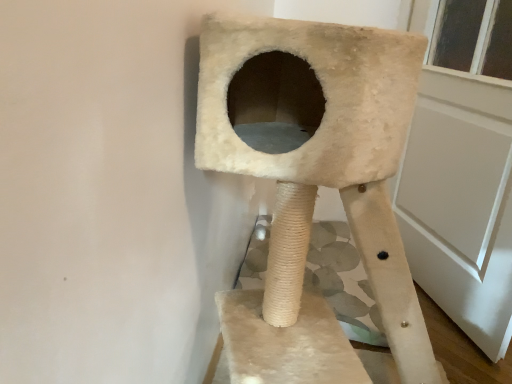
What do you see at coordinates (460, 193) in the screenshot?
I see `white matte screen door at right` at bounding box center [460, 193].

Locate an element on the screen. white matte screen door at right is located at coordinates (460, 193).

What do you see at coordinates (312, 183) in the screenshot? I see `beige furry cat tree at center` at bounding box center [312, 183].

Where is `beige furry cat tree at center`? beige furry cat tree at center is located at coordinates (312, 183).

Image resolution: width=512 pixels, height=384 pixels. I want to click on white matte screen door at right, so click(460, 193).

Does beige furry cat tree at center appear on the left side of white matte screen door at right?

Indeed, beige furry cat tree at center is positioned on the left side of white matte screen door at right.

Between beige furry cat tree at center and white matte screen door at right, which one is positioned in front?

Positioned in front is beige furry cat tree at center.

Looking at this image, which is farther from the camera, (231, 315) or (508, 166)?

The point (508, 166) is farther from the camera.

From the image's perspective, which one is positioned higher, beige furry cat tree at center or white matte screen door at right?

white matte screen door at right.

From the picture: From a real-world perspective, is beige furry cat tree at center under white matte screen door at right?

Yes.

Considering the relative sizes of beige furry cat tree at center and white matte screen door at right in the image provided, is beige furry cat tree at center wider than white matte screen door at right?

Correct, the width of beige furry cat tree at center exceeds that of white matte screen door at right.

Is beige furry cat tree at center taller than white matte screen door at right?

No.

Between beige furry cat tree at center and white matte screen door at right, which one has larger size?

Bigger between the two is beige furry cat tree at center.

Is white matte screen door at right surrounded by beige furry cat tree at center?

That's incorrect, white matte screen door at right is not inside beige furry cat tree at center.

Is beige furry cat tree at center beside white matte screen door at right?

There is a gap between beige furry cat tree at center and white matte screen door at right.

Is beige furry cat tree at center facing away from white matte screen door at right?

No, white matte screen door at right is not at the back of beige furry cat tree at center.

At what (x,y) coordinates should I click in order to perform the action: click on screen door that appears on the right of beige furry cat tree at center. Please return your answer as a coordinate pair (x, y). This screenshot has width=512, height=384. Looking at the image, I should click on (460, 193).

Is white matte screen door at right to the right of beige furry cat tree at center from the viewer's perspective?

Indeed, white matte screen door at right is positioned on the right side of beige furry cat tree at center.

Relative to beige furry cat tree at center, is white matte screen door at right in front or behind?

In the image, white matte screen door at right appears behind beige furry cat tree at center.

Does point (444, 298) appear closer or farther from the camera than point (305, 362)?

Point (444, 298).

From the image's perspective, is white matte screen door at right over beige furry cat tree at center?

Yes, from the image's perspective, white matte screen door at right is over beige furry cat tree at center.

From a real-world perspective, is white matte screen door at right above or below beige furry cat tree at center?

In terms of real-world spatial position, white matte screen door at right is above beige furry cat tree at center.

Which of these two, white matte screen door at right or beige furry cat tree at center, is wider?

beige furry cat tree at center is wider.

Does white matte screen door at right have a lesser height compared to beige furry cat tree at center?

No, white matte screen door at right is not shorter than beige furry cat tree at center.

Considering the sizes of objects white matte screen door at right and beige furry cat tree at center in the image provided, who is smaller, white matte screen door at right or beige furry cat tree at center?

Smaller between the two is white matte screen door at right.

Choose the correct answer: Is white matte screen door at right inside beige furry cat tree at center or outside it?

white matte screen door at right cannot be found inside beige furry cat tree at center.

Is the surface of white matte screen door at right in direct contact with beige furry cat tree at center?

No, white matte screen door at right is not beside beige furry cat tree at center.

From the picture: Is white matte screen door at right positioned with its back to beige furry cat tree at center?

Yes, beige furry cat tree at center is at the back of white matte screen door at right.

Find the location of `furniture located in front of the white matte screen door at right`. furniture located in front of the white matte screen door at right is located at coordinates (312, 183).

Identify the location of screen door behind the beige furry cat tree at center. The image size is (512, 384). (460, 193).

Where is `furniture below the white matte screen door at right (from the image's perspective)`? The width and height of the screenshot is (512, 384). furniture below the white matte screen door at right (from the image's perspective) is located at coordinates pos(312,183).